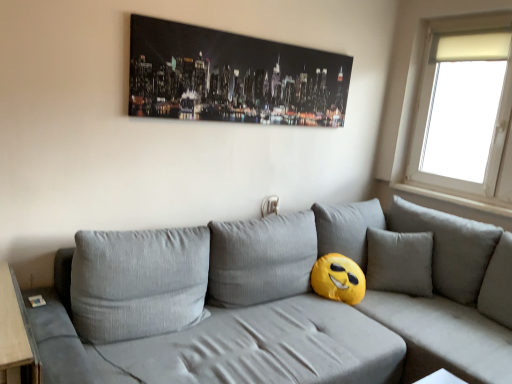
Find the location of `free point above white frosted glass window at upper right (from a real-world perspective)`. free point above white frosted glass window at upper right (from a real-world perspective) is located at coordinates (471, 14).